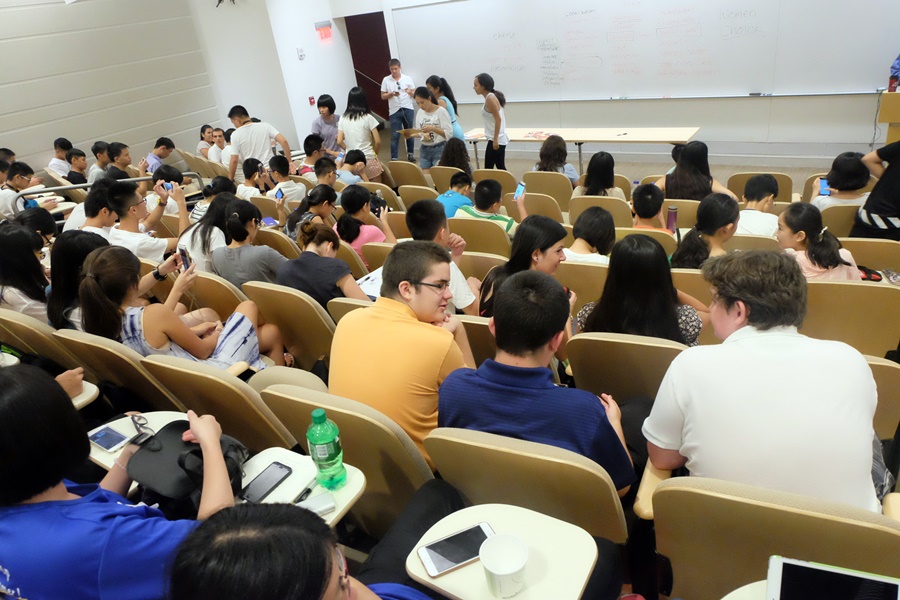
This screenshot has height=600, width=900. I want to click on cup, so click(x=517, y=571).